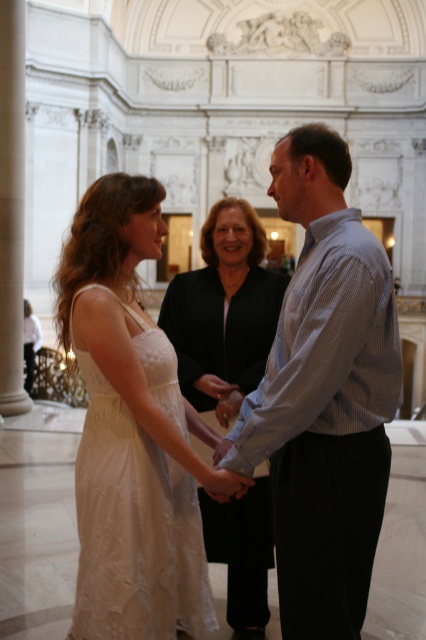
Is white lace dress at center to the right of matte black dress at center from the viewer's perspective?

Incorrect, white lace dress at center is not on the right side of matte black dress at center.

Who is lower down, white lace dress at center or matte black dress at center?

white lace dress at center is below.

This screenshot has width=426, height=640. Describe the element at coordinates (135, 508) in the screenshot. I see `white lace dress at center` at that location.

Identify the location of white lace dress at center. This screenshot has width=426, height=640. (135, 508).

Based on the photo, can you confirm if blue striped shirt at center is positioned to the right of matte black dress at center?

Correct, you'll find blue striped shirt at center to the right of matte black dress at center.

Which is behind, point (319, 179) or point (238, 611)?

Point (238, 611)

Which is behind, point (296, 580) or point (250, 356)?

Positioned behind is point (250, 356).

Where is `blue striped shirt at center`? This screenshot has height=640, width=426. blue striped shirt at center is located at coordinates (324, 396).

Based on the photo, does blue striped shirt at center appear over white lace dress at center?

Indeed, blue striped shirt at center is positioned over white lace dress at center.

Which is more to the right, blue striped shirt at center or white lace dress at center?

blue striped shirt at center is more to the right.

Find the location of `blue striped shirt at center`. blue striped shirt at center is located at coordinates (324, 396).